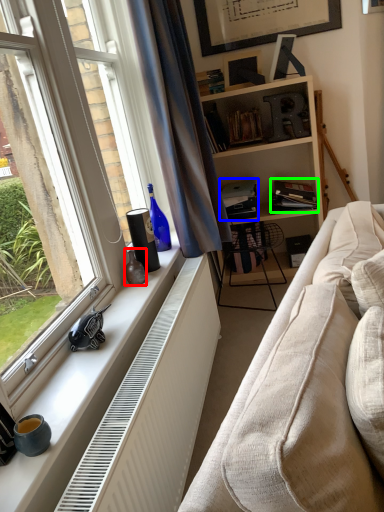
Question: Which object is the closest to the vase (highlighted by a red box)? Choose among these: book (highlighted by a blue box) or book (highlighted by a green box).

Choices:
 (A) book
 (B) book

Answer: (A)